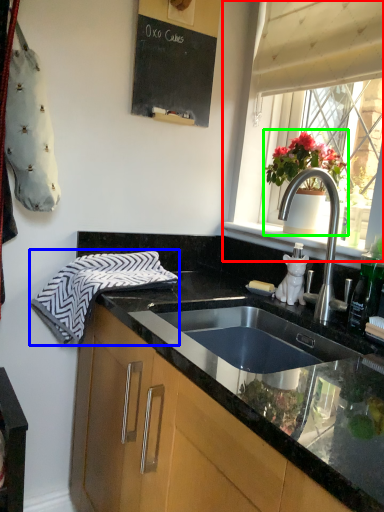
Question: Which object is positioned closest to window (highlighted by a red box)? Select from hand towel (highlighted by a blue box) and houseplant (highlighted by a green box).

Choices:
 (A) hand towel
 (B) houseplant

Answer: (B)